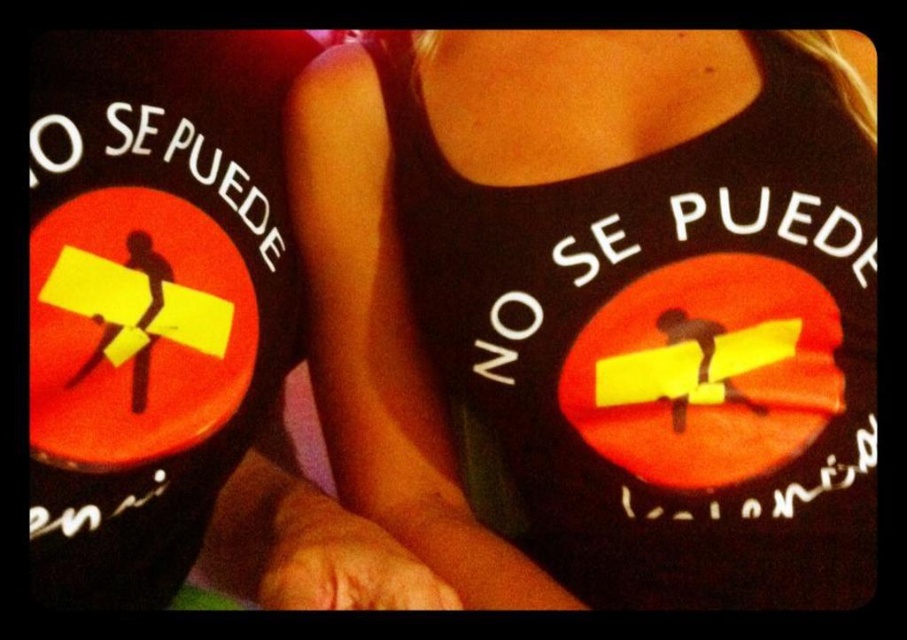
Question: Which point appears farthest from the camera in this image?

Choices:
 (A) (79, 348)
 (B) (791, 307)

Answer: (B)

Question: Which of the following is the farthest from the observer?

Choices:
 (A) (301, 529)
 (B) (590, 129)

Answer: (B)

Question: Does black fabric tank top at center have a lesser width compared to black matte tank top at upper center?

Choices:
 (A) no
 (B) yes

Answer: (A)

Question: Which point is closer to the camera?

Choices:
 (A) black fabric tank top at center
 (B) black matte tank top at upper center

Answer: (B)

Question: Is black fabric tank top at center to the right of black matte tank top at upper center from the viewer's perspective?

Choices:
 (A) no
 (B) yes

Answer: (B)

Question: Can you confirm if black fabric tank top at center is positioned to the left of black matte tank top at upper center?

Choices:
 (A) no
 (B) yes

Answer: (A)